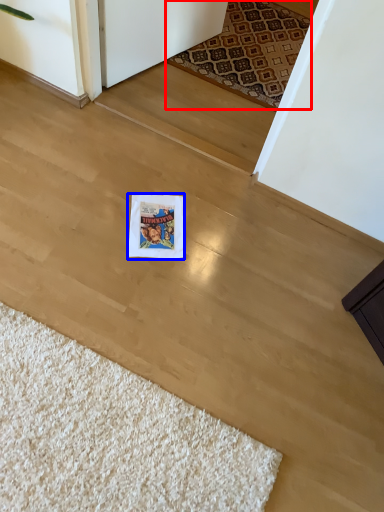
Question: Among these objects, which one is nearest to the camera, mat (highlighted by a red box) or postcard (highlighted by a blue box)?

Choices:
 (A) mat
 (B) postcard

Answer: (B)